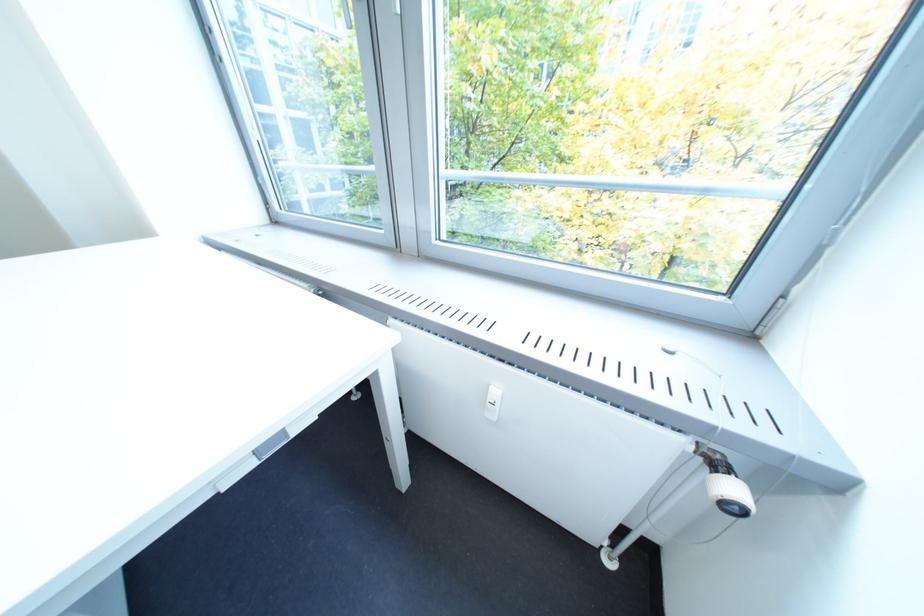
Where would you push the radiator switch? Please return your answer as a coordinate pair (x, y).

(492, 402)